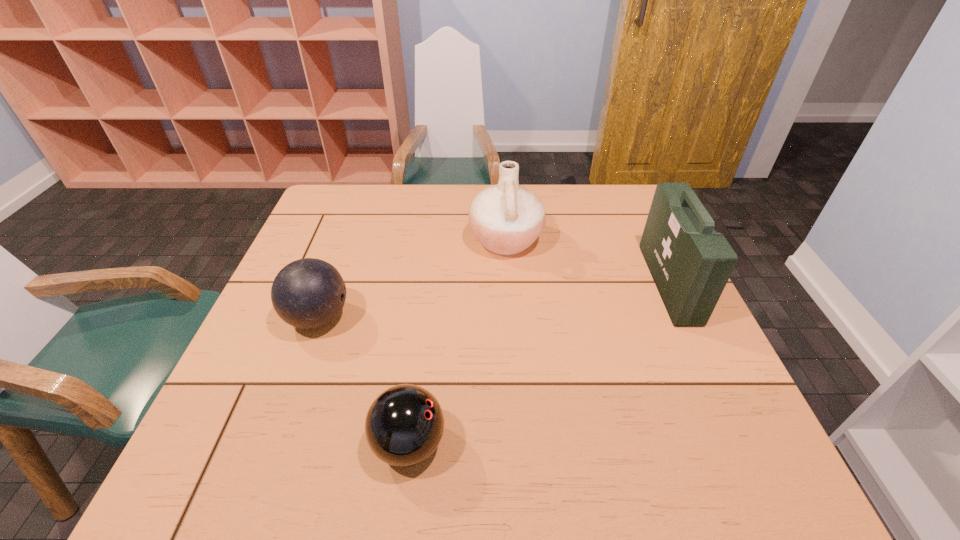
Locate an element on the screen. The image size is (960, 540). free space located 0.130m on the front-facing side of the first-aid kit is located at coordinates (604, 283).

The height and width of the screenshot is (540, 960). Identify the location of free location located on the front-facing side of the first-aid kit. (596, 283).

The image size is (960, 540). In order to click on free space located on the grip area of the leftmost object in this screenshot , I will do `click(441, 318)`.

What are the coordinates of `vacant space located on the surface of the right bowling ball near the finger holes` in the screenshot? It's located at (599, 444).

At what (x,y) coordinates should I click in order to perform the action: click on object at the far edge. Please return your answer as a coordinate pair (x, y). The image size is (960, 540). Looking at the image, I should click on (506, 218).

At what (x,y) coordinates should I click in order to perform the action: click on object that is at the near edge. Please return your answer as a coordinate pair (x, y). Looking at the image, I should click on (404, 425).

Find the location of a particular element. Image resolution: width=960 pixels, height=540 pixels. object at the left edge is located at coordinates (308, 293).

Find the location of `object present at the right edge`. object present at the right edge is located at coordinates (690, 263).

Where is `vacant space at the far edge of the desktop`? The width and height of the screenshot is (960, 540). vacant space at the far edge of the desktop is located at coordinates (583, 221).

You are a GUI agent. You are given a task and a screenshot of the screen. Output one action in this format:
    pyautogui.click(x=<x>, y=<y>)
    Task: Click on the vacant space at the near edge of the desktop
    The image size is (960, 540).
    Given the screenshot: What is the action you would take?
    pyautogui.click(x=305, y=476)